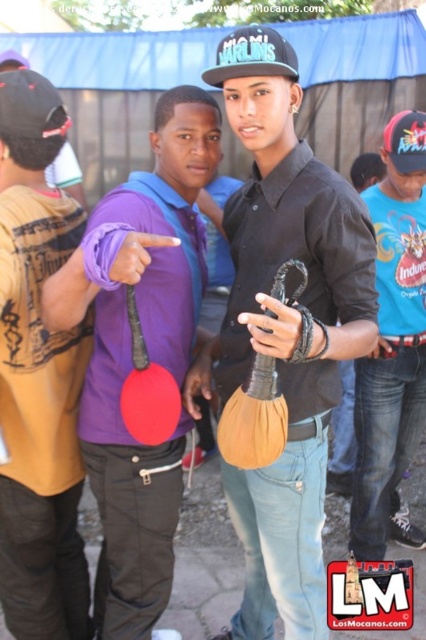
Looking at this image, can you confirm if blue cotton shirt at right is positioned below black matte baseball cap at center?

Correct, blue cotton shirt at right is located below black matte baseball cap at center.

Can you confirm if blue cotton shirt at right is taller than black matte baseball cap at center?

Yes.

This screenshot has height=640, width=426. What do you see at coordinates (393, 346) in the screenshot?
I see `blue cotton shirt at right` at bounding box center [393, 346].

At what (x,y) coordinates should I click in order to perform the action: click on blue cotton shirt at right. Please return your answer as a coordinate pair (x, y). The image size is (426, 640). Looking at the image, I should click on (393, 346).

Does matte black shirt at center appear over black matte baseball cap at center?

No, matte black shirt at center is not above black matte baseball cap at center.

Between matte black shirt at center and black matte baseball cap at center, which one appears on the left side from the viewer's perspective?

Positioned to the left is black matte baseball cap at center.

Image resolution: width=426 pixels, height=640 pixels. I want to click on matte black shirt at center, so click(284, 328).

Between matte black shirt at center and blue cotton shirt at right, which one is positioned lower?

matte black shirt at center is below.

How distant is matte black shirt at center from blue cotton shirt at right?

A distance of 38.56 inches exists between matte black shirt at center and blue cotton shirt at right.

I want to click on matte black shirt at center, so click(284, 328).